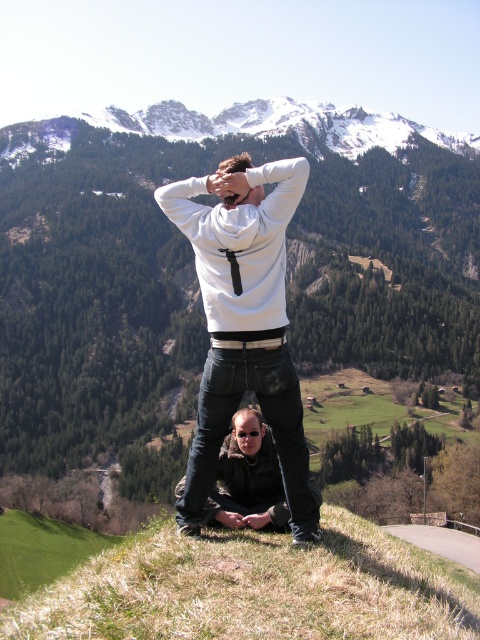
Question: Which of the following is the closest to the observer?

Choices:
 (A) smooth skin forehead at center
 (B) white matte hoodie at center

Answer: (B)

Question: Is white matte hoodie at center positioned before smooth skin forehead at center?

Choices:
 (A) no
 (B) yes

Answer: (B)

Question: Is white matte hoodie at center bigger than black leather jacket at lower center?

Choices:
 (A) yes
 (B) no

Answer: (A)

Question: Is white matte hoodie at center smaller than snowy granite mountain at upper center?

Choices:
 (A) no
 (B) yes

Answer: (B)

Question: Which object is closer to the camera taking this photo?

Choices:
 (A) white matte hoodie at center
 (B) smooth skin forehead at center
 (C) black leather jacket at lower center

Answer: (A)

Question: Which of the following is the closest to the observer?

Choices:
 (A) white matte hoodie at center
 (B) smooth skin forehead at center

Answer: (A)